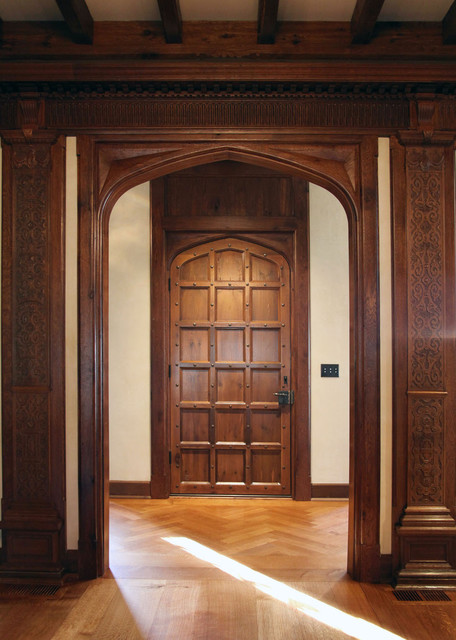
The height and width of the screenshot is (640, 456). In order to click on ceiling in this screenshot , I will do `click(310, 9)`, `click(126, 12)`.